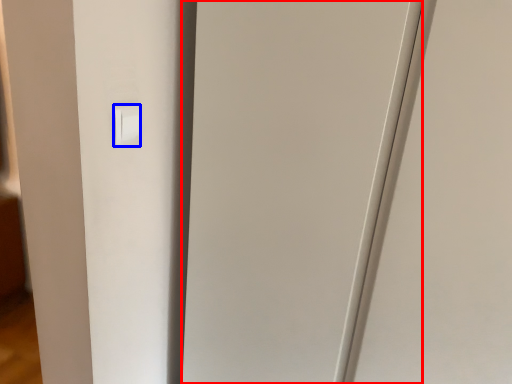
Question: Which of the following is the closest to the observer, glass door (highlighted by a red box) or light switch (highlighted by a blue box)?

Choices:
 (A) glass door
 (B) light switch

Answer: (A)